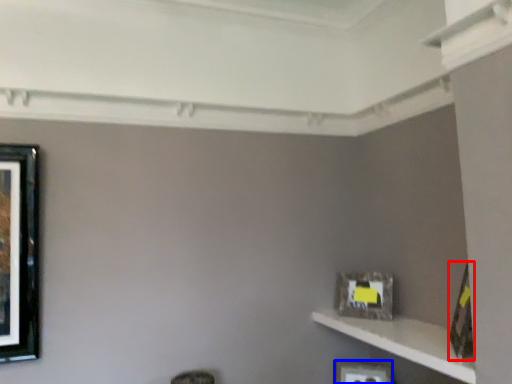
Question: Which object is further to the camera taking this photo, picture frame (highlighted by a red box) or picture frame (highlighted by a blue box)?

Choices:
 (A) picture frame
 (B) picture frame

Answer: (B)